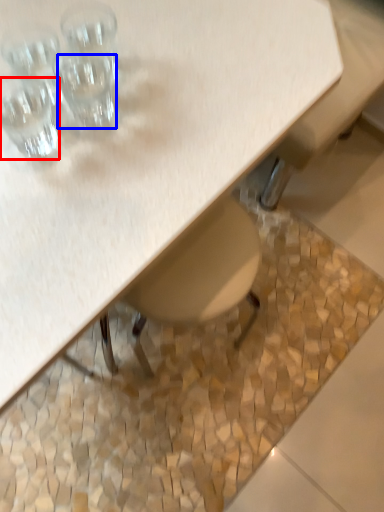
Question: Which object is further to the camera taking this photo, shot glass (highlighted by a red box) or shot glass (highlighted by a blue box)?

Choices:
 (A) shot glass
 (B) shot glass

Answer: (B)